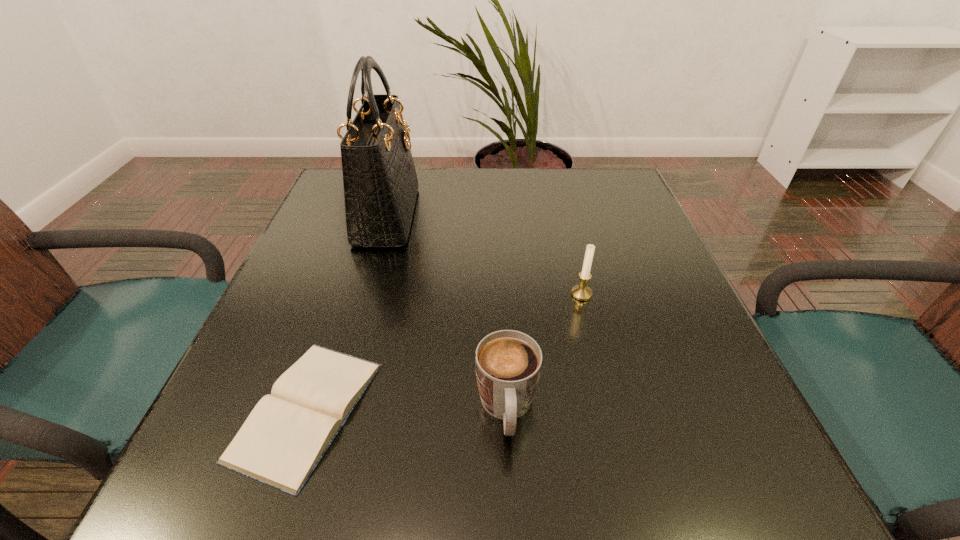
Where is `free space that is in between the second object from right to left and the Bible`? This screenshot has height=540, width=960. free space that is in between the second object from right to left and the Bible is located at coordinates (407, 409).

Locate an element on the screen. This screenshot has height=540, width=960. empty space between the shortest object and the tallest object is located at coordinates (348, 313).

This screenshot has height=540, width=960. I want to click on empty space between the third nearest object and the shortest object, so click(444, 352).

Identify which object is located as the nearest to the third tallest object. Please provide its 2D coordinates. Your answer should be formatted as a tuple, i.e. [(x, y)], where the tuple contains the x and y coordinates of a point satisfying the conditions above.

[(283, 439)]

At what (x,y) coordinates should I click in order to perform the action: click on object that can be found as the third closest to the handbag. Please return your answer as a coordinate pair (x, y). Looking at the image, I should click on (581, 292).

This screenshot has width=960, height=540. Identify the location of vacant space that satisfies the following two spatial constraints: 1. at the front of the farthest object with visible charms; 2. on the right side of the candle holder. (365, 294).

The width and height of the screenshot is (960, 540). In order to click on free location that satisfies the following two spatial constraints: 1. at the front of the candle holder with visible charms; 2. on the right side of the tallest object in this screenshot , I will do `click(365, 294)`.

Locate an element on the screen. The width and height of the screenshot is (960, 540). vacant space that satisfies the following two spatial constraints: 1. at the front of the farthest object with visible charms; 2. on the back side of the rightmost object is located at coordinates (365, 294).